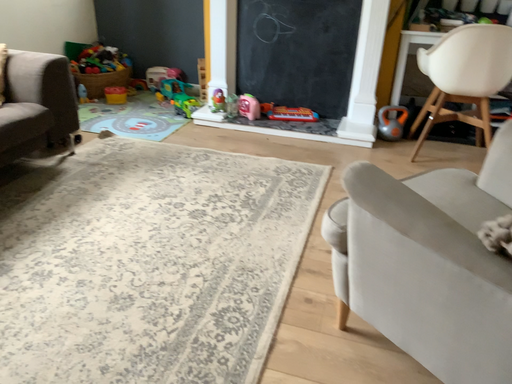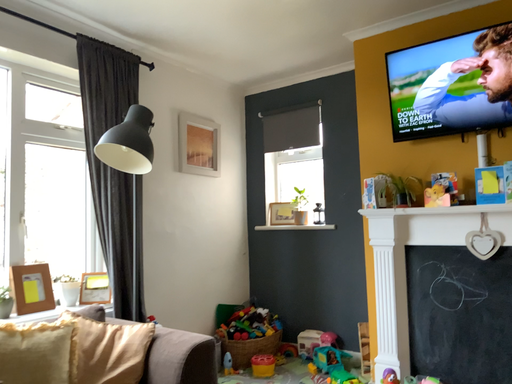
Question: Which way did the camera rotate in the video?

Choices:
 (A) rotated upward
 (B) rotated downward

Answer: (A)